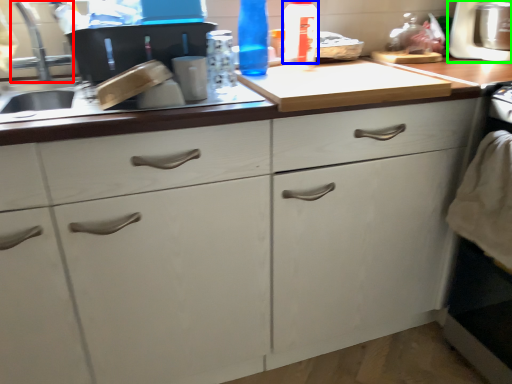
Question: Which object is the closest to the faucet (highlighted by a red box)? Choose among these: bottle (highlighted by a blue box) or appliance (highlighted by a green box).

Choices:
 (A) bottle
 (B) appliance

Answer: (A)